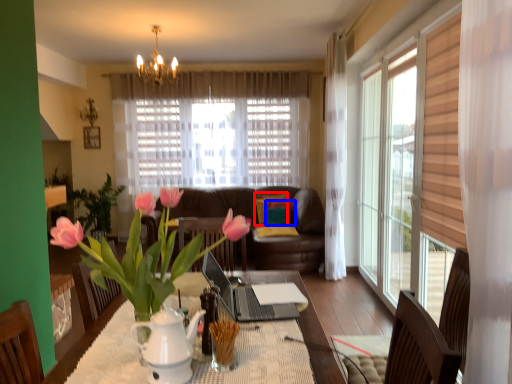
Question: Which of the following is the closest to the observer, pillow (highlighted by a red box) or pillow (highlighted by a blue box)?

Choices:
 (A) pillow
 (B) pillow

Answer: (B)